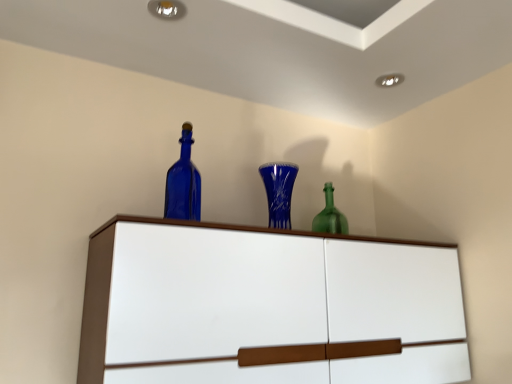
Question: Is blue glass bottle at upper center outside blue glass vase at center?

Choices:
 (A) yes
 (B) no

Answer: (A)

Question: Is blue glass bottle at upper center shorter than blue glass vase at center?

Choices:
 (A) no
 (B) yes

Answer: (A)

Question: Considering the relative positions of blue glass bottle at upper center and blue glass vase at center in the image provided, is blue glass bottle at upper center behind blue glass vase at center?

Choices:
 (A) no
 (B) yes

Answer: (A)

Question: Would you say blue glass bottle at upper center contains blue glass vase at center?

Choices:
 (A) no
 (B) yes

Answer: (A)

Question: Could you tell me if blue glass bottle at upper center is turned towards blue glass vase at center?

Choices:
 (A) yes
 (B) no

Answer: (B)

Question: Would you say blue glass bottle at upper center is to the left or to the right of white glossy cupboard at upper center in the picture?

Choices:
 (A) right
 (B) left

Answer: (B)

Question: In terms of size, does blue glass bottle at upper center appear bigger or smaller than white glossy cupboard at upper center?

Choices:
 (A) big
 (B) small

Answer: (B)

Question: From a real-world perspective, is blue glass bottle at upper center above or below white glossy cupboard at upper center?

Choices:
 (A) below
 (B) above

Answer: (B)

Question: From the image's perspective, relative to white glossy cupboard at upper center, is blue glass bottle at upper center above or below?

Choices:
 (A) above
 (B) below

Answer: (A)

Question: Considering their positions, is white glossy cupboard at upper center located in front of or behind blue glass bottle at upper center?

Choices:
 (A) front
 (B) behind

Answer: (A)

Question: From the image's perspective, relative to blue glass bottle at upper center, is white glossy cupboard at upper center above or below?

Choices:
 (A) below
 (B) above

Answer: (A)

Question: Do you think white glossy cupboard at upper center is within blue glass bottle at upper center, or outside of it?

Choices:
 (A) inside
 (B) outside

Answer: (B)

Question: Looking at the image, does white glossy cupboard at upper center seem bigger or smaller compared to blue glass bottle at upper center?

Choices:
 (A) small
 (B) big

Answer: (B)

Question: Looking at their shapes, would you say blue glass vase at center is wider or thinner than white glossy cupboard at upper center?

Choices:
 (A) thin
 (B) wide

Answer: (A)

Question: Based on their sizes in the image, would you say blue glass vase at center is bigger or smaller than white glossy cupboard at upper center?

Choices:
 (A) small
 (B) big

Answer: (A)